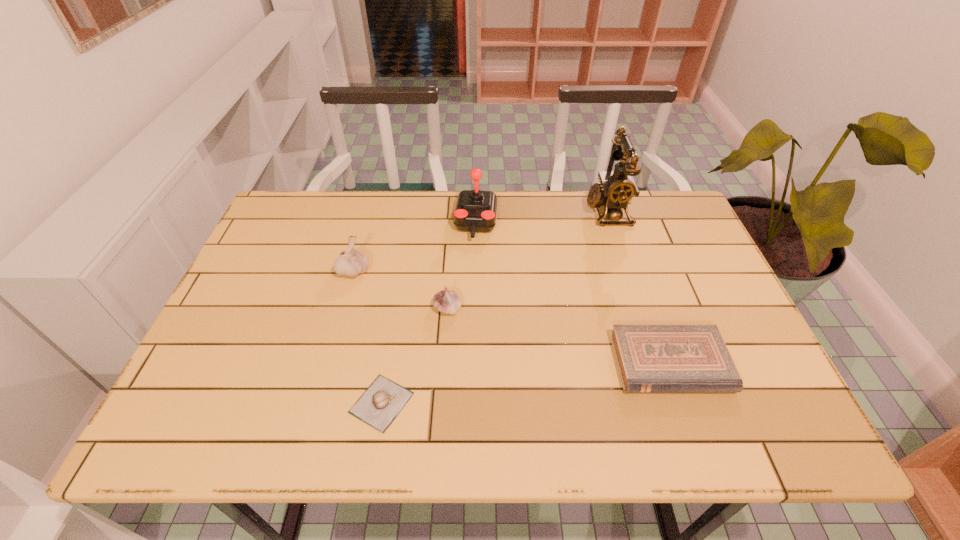
The image size is (960, 540). I want to click on free space between the tallest object and the second tallest object, so click(541, 217).

Identify the location of vacant space that's between the joystick and the Bible. The image size is (960, 540). (573, 293).

Locate an element on the screen. This screenshot has height=540, width=960. free space between the Bible and the shortest object is located at coordinates (526, 383).

Where is `free space between the telephone and the second tallest garlic`? The height and width of the screenshot is (540, 960). free space between the telephone and the second tallest garlic is located at coordinates (527, 260).

Where is `vacant space that is in between the fourth tallest object and the third farthest object`? The image size is (960, 540). vacant space that is in between the fourth tallest object and the third farthest object is located at coordinates (400, 289).

This screenshot has height=540, width=960. Find the location of `vacant area that lies between the joystick and the rightmost garlic`. vacant area that lies between the joystick and the rightmost garlic is located at coordinates [462, 266].

The width and height of the screenshot is (960, 540). In order to click on object that is the fourth closest to the second shortest object in this screenshot , I will do `click(383, 400)`.

Where is `object identified as the second closest to the Bible`? The height and width of the screenshot is (540, 960). object identified as the second closest to the Bible is located at coordinates (616, 189).

Locate an element on the screen. This screenshot has height=540, width=960. garlic that is the second nearest to the rightmost garlic is located at coordinates (351, 262).

Identify the location of garlic that is the second closest to the tallest garlic. (383, 400).